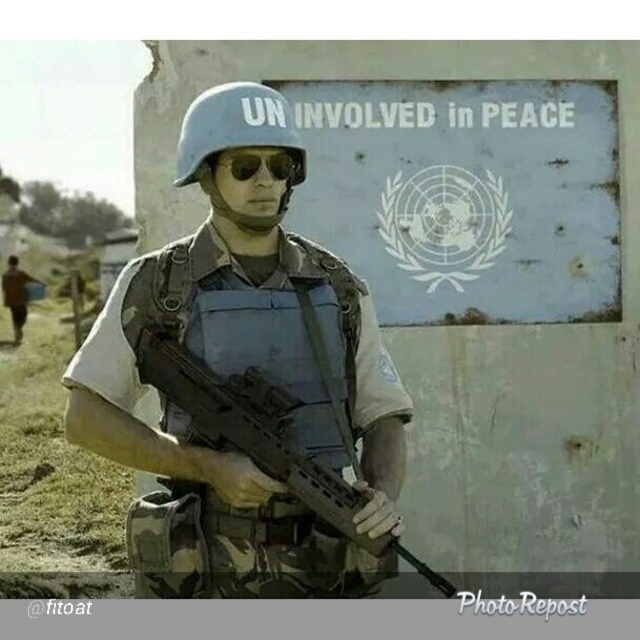
Question: Which object is the farthest from the matte blue helmet at center?

Choices:
 (A) sunglassestransparent at center
 (B) matte black rifle at center
 (C) brown fabric shirt at lower left

Answer: (C)

Question: Which point appears farthest from the camera in this image?

Choices:
 (A) (20, 280)
 (B) (177, 397)
 (C) (337, 564)

Answer: (A)

Question: Does sunglassestransparent at center appear under brown fabric shirt at lower left?

Choices:
 (A) no
 (B) yes

Answer: (A)

Question: Does matte black rifle at center appear over brown fabric shirt at lower left?

Choices:
 (A) no
 (B) yes

Answer: (A)

Question: Is matte blue helmet at center below sunglassestransparent at center?

Choices:
 (A) yes
 (B) no

Answer: (A)

Question: Which of the following is the closest to the observer?

Choices:
 (A) (138, 374)
 (B) (252, 148)

Answer: (B)